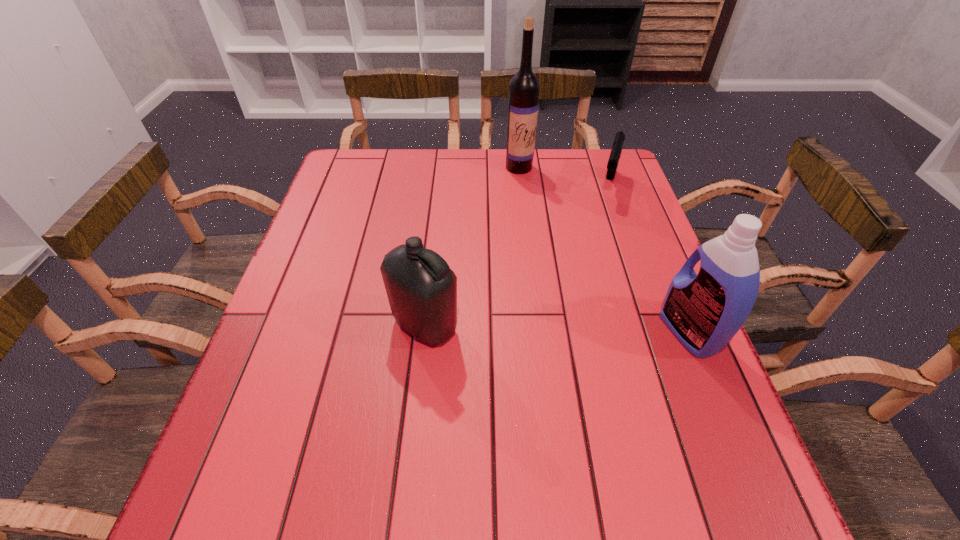
Locate an element on the screen. vacant space located 0.300m on the label of the wine bottle is located at coordinates (547, 238).

Where is `free space located 0.100m at the barrel of the shortest object`? Image resolution: width=960 pixels, height=540 pixels. free space located 0.100m at the barrel of the shortest object is located at coordinates (604, 224).

Where is `vacant space situated at the barrel of the shortest object`? Image resolution: width=960 pixels, height=540 pixels. vacant space situated at the barrel of the shortest object is located at coordinates (601, 233).

In order to click on vacant space located at the barrel of the shortest object in this screenshot , I will do `click(590, 276)`.

The height and width of the screenshot is (540, 960). Find the location of `wine bottle situated at the far edge`. wine bottle situated at the far edge is located at coordinates (524, 87).

At what (x,y) coordinates should I click in order to perform the action: click on pistol at the far edge. Please return your answer as a coordinate pair (x, y). Looking at the image, I should click on (616, 151).

I want to click on detergent present at the right edge, so click(x=705, y=311).

Find the location of a particular element. Image resolution: width=960 pixels, height=540 pixels. pistol that is positioned at the right edge is located at coordinates (616, 151).

Where is `object present at the far right corner`? The width and height of the screenshot is (960, 540). object present at the far right corner is located at coordinates (616, 151).

Identify the location of free space at the far edge. This screenshot has height=540, width=960. (405, 160).